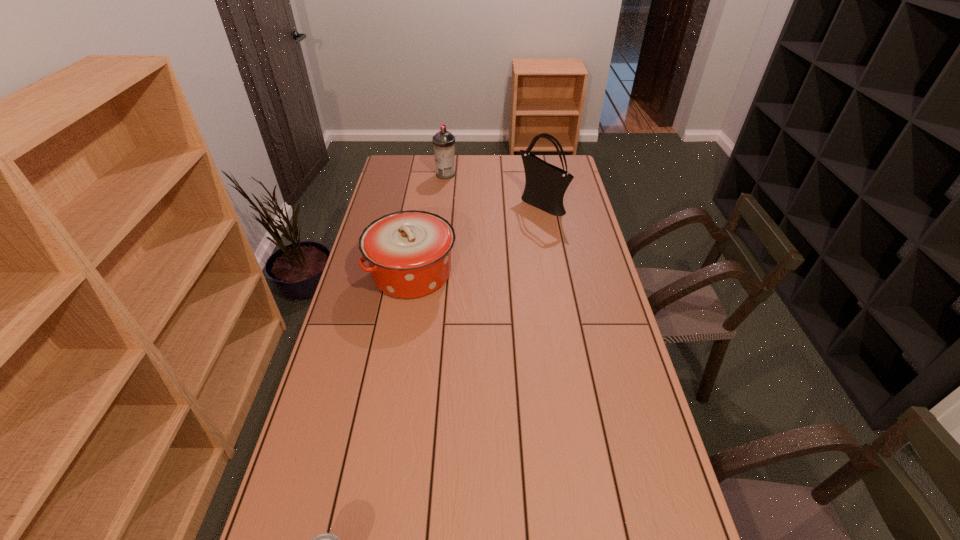
At what (x,y) coordinates should I click in order to perform the action: click on vacant space that satisfies the following two spatial constraints: 1. on the front side of the shoulder bag; 2. on the right side of the farthest object. Please return your answer as a coordinate pair (x, y). The image size is (960, 540). Looking at the image, I should click on (443, 204).

At what (x,y) coordinates should I click in order to perform the action: click on blank space that satisfies the following two spatial constraints: 1. on the back side of the aerosol can; 2. on the left side of the second shortest object. Please return your answer as a coordinate pair (x, y). The image size is (960, 540). Looking at the image, I should click on (429, 175).